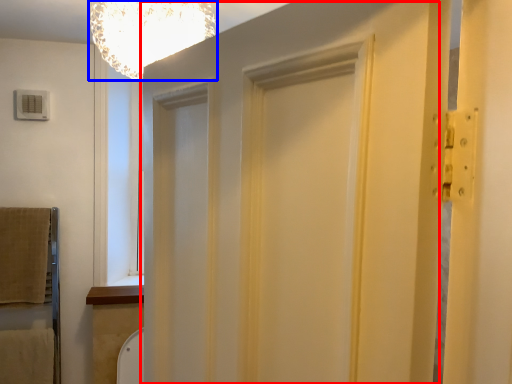
Question: Which object is closer to the camera taking this photo, barn door (highlighted by a red box) or light fixture (highlighted by a blue box)?

Choices:
 (A) barn door
 (B) light fixture

Answer: (A)